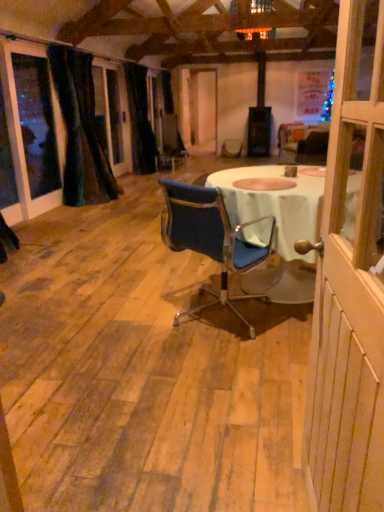
Question: In terms of width, does velvet dark green curtain at left, placed as the 1th curtain when sorted from front to back, look wider or thinner when compared to black velvet curtain at left, arranged as the 1th curtain when viewed from the back?

Choices:
 (A) wide
 (B) thin

Answer: (A)

Question: Relative to black velvet curtain at left, arranged as the 1th curtain when viewed from the back, is velvet dark green curtain at left, placed as the 1th curtain when sorted from front to back, in front or behind?

Choices:
 (A) behind
 (B) front

Answer: (B)

Question: Considering the real-world distances, which object is farthest from the white wood screen door at right?

Choices:
 (A) velvet dark green curtain at left, placed as the 1th curtain when sorted from front to back
 (B) blue fabric chair at center
 (C) black velvet curtain at left, which is counted as the 2th curtain, starting from the front

Answer: (C)

Question: Which object is positioned farthest from the velvet dark green curtain at left, placed as the 1th curtain when sorted from front to back?

Choices:
 (A) blue fabric chair at center
 (B) white wood screen door at right
 (C) black velvet curtain at left, arranged as the 1th curtain when viewed from the back

Answer: (B)